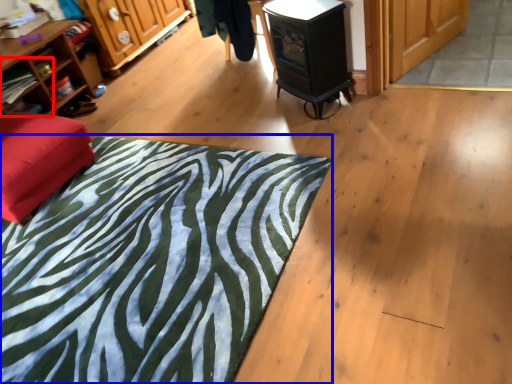
Question: Which point is further to the camera, shelf (highlighted by a red box) or mat (highlighted by a blue box)?

Choices:
 (A) shelf
 (B) mat

Answer: (A)